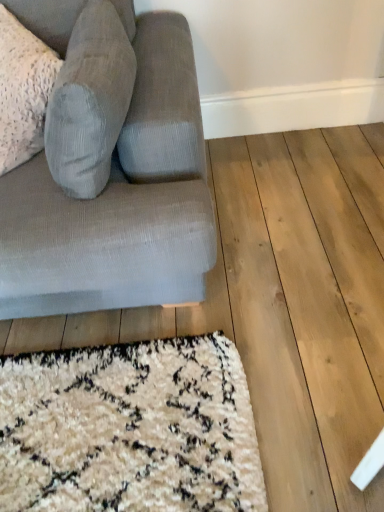
Question: From the image's perspective, is textured corduroy pillow at left above textured gray couch at left?

Choices:
 (A) yes
 (B) no

Answer: (A)

Question: Is textured corduroy pillow at left smaller than textured gray couch at left?

Choices:
 (A) yes
 (B) no

Answer: (A)

Question: Are textured corduroy pillow at left and textured gray couch at left located far from each other?

Choices:
 (A) yes
 (B) no

Answer: (B)

Question: Does textured corduroy pillow at left appear on the left side of textured gray couch at left?

Choices:
 (A) yes
 (B) no

Answer: (A)

Question: Would you say textured corduroy pillow at left contains textured gray couch at left?

Choices:
 (A) yes
 (B) no

Answer: (B)

Question: From a real-world perspective, does textured corduroy pillow at left stand above textured gray couch at left?

Choices:
 (A) yes
 (B) no

Answer: (A)

Question: From the image's perspective, is textured gray couch at left on textured corduroy pillow at left?

Choices:
 (A) yes
 (B) no

Answer: (B)

Question: Could you tell me if textured gray couch at left is turned towards textured corduroy pillow at left?

Choices:
 (A) yes
 (B) no

Answer: (A)

Question: Is textured gray couch at left in contact with textured corduroy pillow at left?

Choices:
 (A) yes
 (B) no

Answer: (B)

Question: Can you confirm if textured gray couch at left is smaller than textured corduroy pillow at left?

Choices:
 (A) yes
 (B) no

Answer: (B)

Question: Is textured gray couch at left wider than textured corduroy pillow at left?

Choices:
 (A) yes
 (B) no

Answer: (A)

Question: Is textured gray couch at left looking in the opposite direction of textured corduroy pillow at left?

Choices:
 (A) yes
 (B) no

Answer: (A)

Question: From a real-world perspective, is textured gray couch at left above or below textured corduroy pillow at left?

Choices:
 (A) below
 (B) above

Answer: (A)